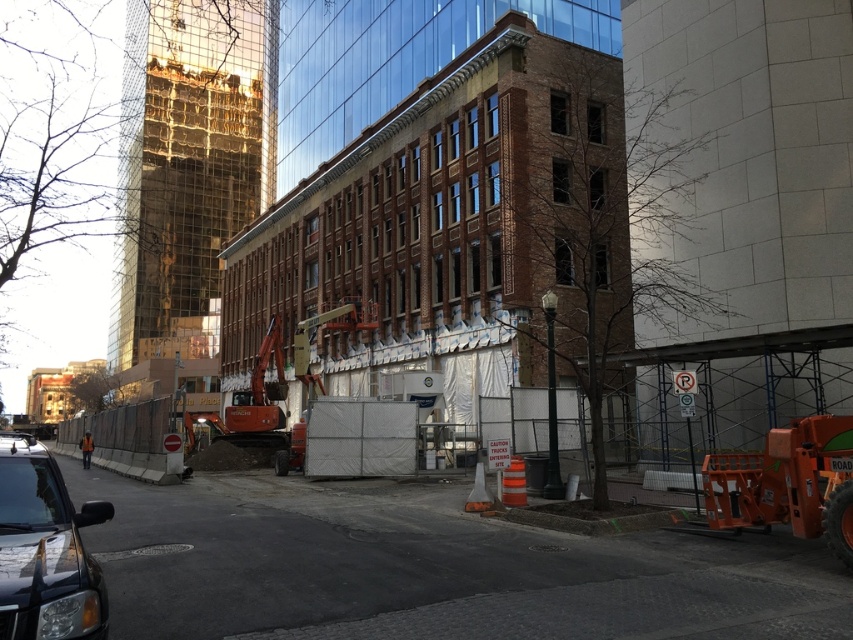
You are a pedestrian standing on the sidewalk near the construction site. You see the shiny black suv at lower left and the orange reflective vest at lower left. Which object is nearer to you?

The shiny black suv at lower left is closer to the viewer than the orange reflective vest at lower left, so the shiny black suv at lower left is nearer to you.

You are a pedestrian standing on the sidewalk near the construction site. You see the shiny black suv at lower left and the orange reflective vest at lower left. Which object is narrower?

The shiny black suv at lower left is thinner than the orange reflective vest at lower left, so the shiny black suv at lower left is narrower.